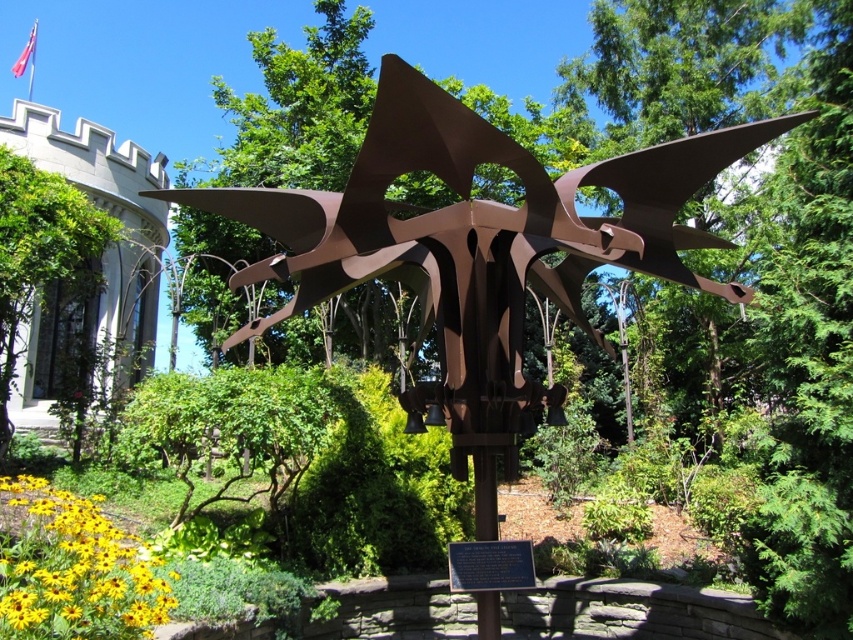
You are a landscape architect designing a new garden layout. You need to place a new bench exactly halfway between the rusty metal sculpture at center and the green leafy tree at left. Given that the sculpture is wider than the tree, which object will the bench be closer to?

The bench will be closer to the green leafy tree at left because the rusty metal sculpture at center has a larger width, meaning the midpoint between them would be nearer to the smaller object.

You are standing at the entrance of the garden and want to locate the rusty metal sculpture at center. According to the coordinates provided, where should you look to find it?

The rusty metal sculpture at center is located at coordinates point (479, 252).